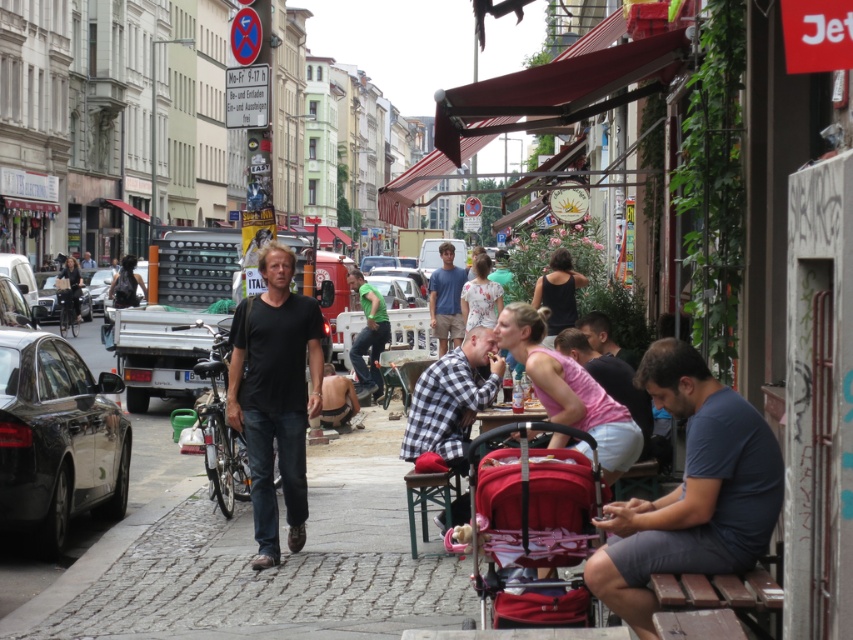
You are a photographer standing on the street and want to capture both the matte red stroller at center and the green matte shirt at center in a single photo. Which object should you focus on first to ensure both are in frame?

You should focus on the matte red stroller at center first since it is smaller than the green matte shirt at center, allowing you to frame both objects effectively.